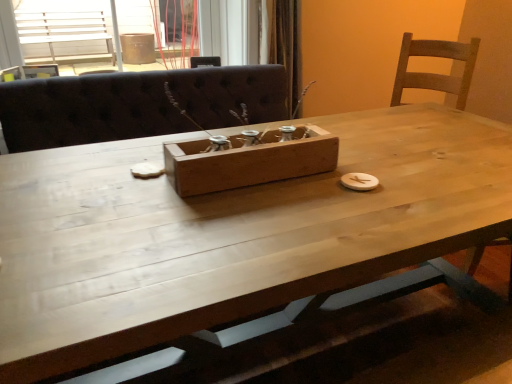
I want to click on free space to the right of wooden box at center, so click(375, 182).